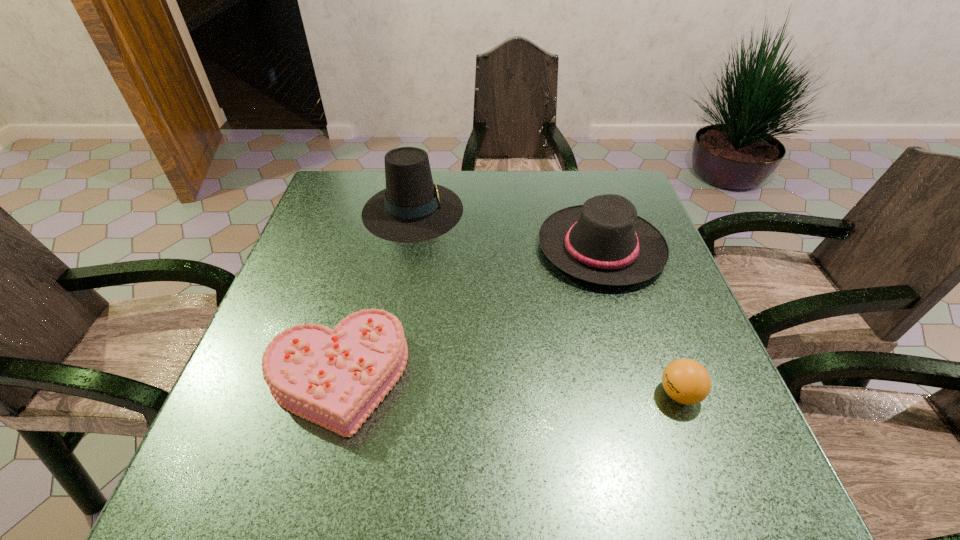
Where is `free region at the left edge`? The width and height of the screenshot is (960, 540). free region at the left edge is located at coordinates (311, 254).

This screenshot has width=960, height=540. In the image, there is a desktop. Identify the location of blank space at the right edge. (652, 402).

Image resolution: width=960 pixels, height=540 pixels. Find the location of `vacant space at the far left corner`. vacant space at the far left corner is located at coordinates (330, 194).

Identify the location of blank area at the near left corner. (226, 490).

The height and width of the screenshot is (540, 960). In the image, there is a desktop. In order to click on free space at the far right corner in this screenshot , I will do `click(584, 181)`.

At what (x,y) coordinates should I click in order to perform the action: click on empty location between the right dress hat and the cake. Please return your answer as a coordinate pair (x, y). The height and width of the screenshot is (540, 960). Looking at the image, I should click on (469, 312).

Where is `vacant region between the taller dress hat and the ping-pong ball`? The height and width of the screenshot is (540, 960). vacant region between the taller dress hat and the ping-pong ball is located at coordinates (546, 302).

Locate an element on the screen. This screenshot has width=960, height=540. vacant area that lies between the ping-pong ball and the third shortest object is located at coordinates (640, 321).

This screenshot has height=540, width=960. Identify the location of free space between the left dress hat and the cake. (375, 293).

You are a GUI agent. You are given a task and a screenshot of the screen. Output one action in this format:
    pyautogui.click(x=<x>, y=<y>)
    Task: Click on the free area in between the cake and the ping-pong ball
    
    Given the screenshot: What is the action you would take?
    pyautogui.click(x=509, y=385)